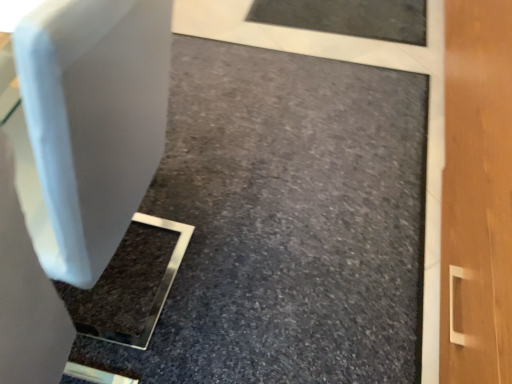
Question: Considering the positions of matte white concrete at center and white plastic swivel chair at left in the image, is matte white concrete at center taller or shorter than white plastic swivel chair at left?

Choices:
 (A) tall
 (B) short

Answer: (B)

Question: From a real-world perspective, is matte white concrete at center above or below white plastic swivel chair at left?

Choices:
 (A) above
 (B) below

Answer: (B)

Question: Looking at their shapes, would you say matte white concrete at center is wider or thinner than white plastic swivel chair at left?

Choices:
 (A) thin
 (B) wide

Answer: (B)

Question: From the image's perspective, relative to matte white concrete at center, is white plastic swivel chair at left above or below?

Choices:
 (A) below
 (B) above

Answer: (B)

Question: From a real-world perspective, relative to matte white concrete at center, is white plastic swivel chair at left vertically above or below?

Choices:
 (A) above
 (B) below

Answer: (A)

Question: Is white plastic swivel chair at left situated inside matte white concrete at center or outside?

Choices:
 (A) inside
 (B) outside

Answer: (B)

Question: Would you say white plastic swivel chair at left is to the left or to the right of matte white concrete at center in the picture?

Choices:
 (A) left
 (B) right

Answer: (A)